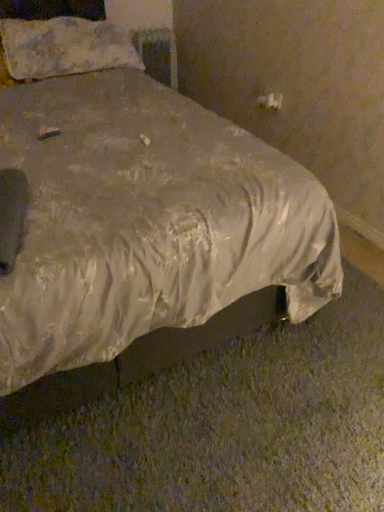
Question: Relative to metallic silver radiator at upper center, is fluffy white pillow at upper left in front or behind?

Choices:
 (A) front
 (B) behind

Answer: (A)

Question: In terms of width, does fluffy white pillow at upper left look wider or thinner when compared to metallic silver radiator at upper center?

Choices:
 (A) wide
 (B) thin

Answer: (A)

Question: Estimate the real-world distances between objects in this image. Which object is farther from the fluffy white pillow at upper left?

Choices:
 (A) metallic silver radiator at upper center
 (B) silvery satin bed at center

Answer: (A)

Question: Estimate the real-world distances between objects in this image. Which object is closer to the metallic silver radiator at upper center?

Choices:
 (A) fluffy white pillow at upper left
 (B) silvery satin bed at center

Answer: (A)